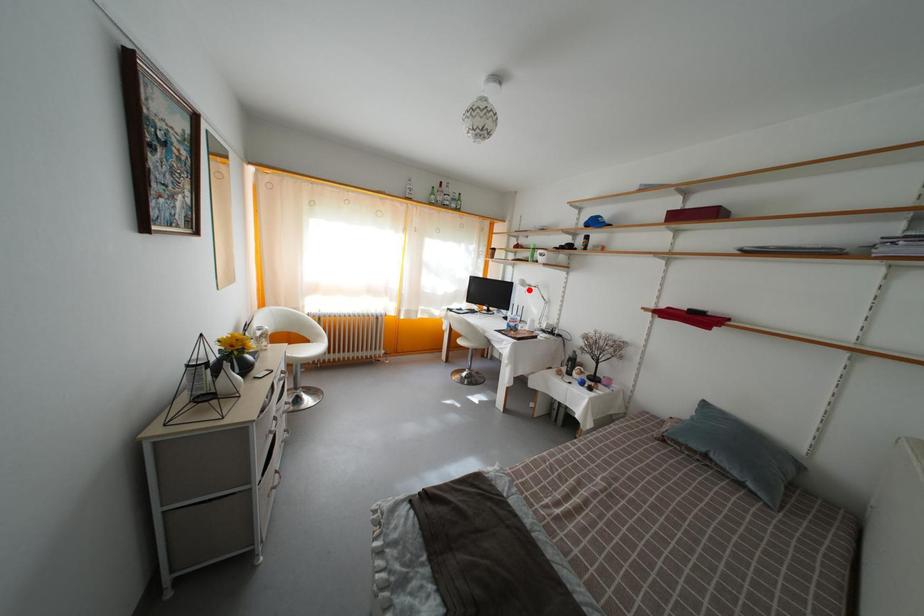
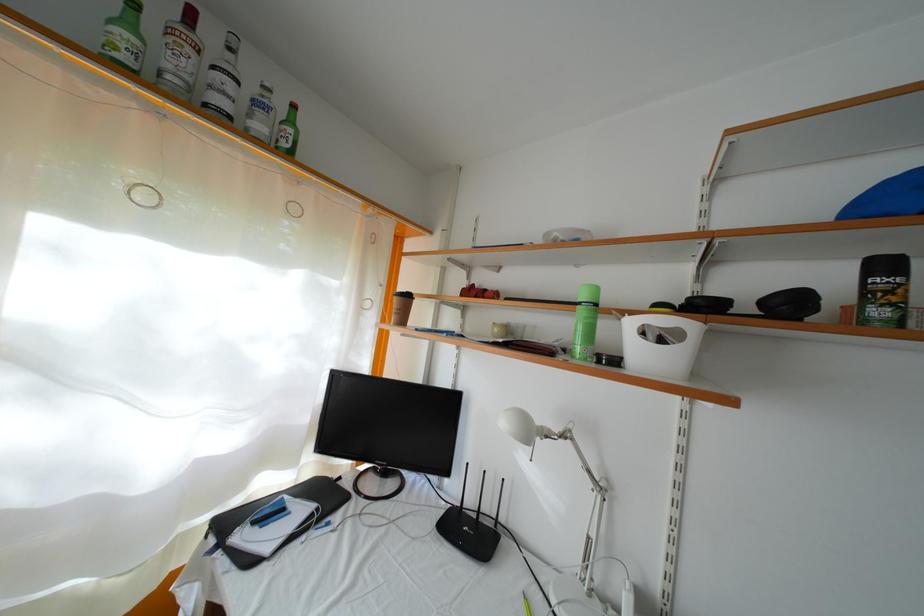
In the second image, find the point that corresponds to the highlighted location in the first image.

(535, 439)